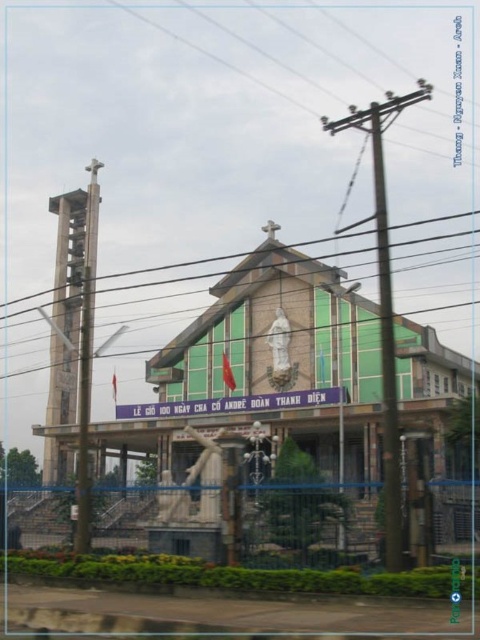
You are standing at the bottom of the steps leading to the church entrance. Looking up, you see the green stone church at center and the brown wooden telegraph pole at upper center. Which object is higher in your field of view?

The brown wooden telegraph pole at upper center is higher in your field of view because it is positioned above the green stone church at center.

You are a delivery person needing to park your van, which is 18 meters long, near the church. There is a space between the green stone church at center and the metallic gray telegraph pole at left. Can your van fit in that space?

The distance between the green stone church at center and the metallic gray telegraph pole at left is 19.11 meters. Since the van is 18 meters long, it can fit in the space between them.